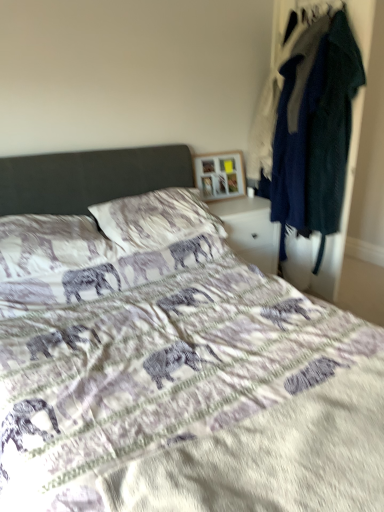
Question: Which direction should I rotate to look at textured white pillow at center, acting as the 1th pillow starting from the right?

Choices:
 (A) left
 (B) right

Answer: (A)

Question: Considering the relative sizes of white glossy nightstand at center and textured cotton pillow at center, acting as the first pillow starting from the left, in the image provided, is white glossy nightstand at center taller than textured cotton pillow at center, acting as the first pillow starting from the left,?

Choices:
 (A) yes
 (B) no

Answer: (A)

Question: Is white glossy nightstand at center closer to camera compared to textured cotton pillow at center, arranged as the 2th pillow when viewed from the right?

Choices:
 (A) no
 (B) yes

Answer: (A)

Question: Is white glossy nightstand at center outside textured cotton pillow at center, acting as the first pillow starting from the left?

Choices:
 (A) yes
 (B) no

Answer: (A)

Question: Is white glossy nightstand at center shorter than textured cotton pillow at center, arranged as the 2th pillow when viewed from the right?

Choices:
 (A) no
 (B) yes

Answer: (A)

Question: Can you confirm if white glossy nightstand at center is positioned to the left of textured cotton pillow at center, arranged as the 2th pillow when viewed from the right?

Choices:
 (A) no
 (B) yes

Answer: (A)

Question: Is white glossy nightstand at center oriented towards textured cotton pillow at center, arranged as the 2th pillow when viewed from the right?

Choices:
 (A) no
 (B) yes

Answer: (A)

Question: Is textured cotton pillow at center, arranged as the 2th pillow when viewed from the right, positioned before printed fabric bed at center?

Choices:
 (A) yes
 (B) no

Answer: (B)

Question: Can you confirm if textured cotton pillow at center, acting as the first pillow starting from the left, is taller than printed fabric bed at center?

Choices:
 (A) yes
 (B) no

Answer: (B)

Question: From the image's perspective, would you say textured cotton pillow at center, acting as the first pillow starting from the left, is positioned over printed fabric bed at center?

Choices:
 (A) no
 (B) yes

Answer: (B)

Question: Does textured cotton pillow at center, acting as the first pillow starting from the left, have a larger size compared to printed fabric bed at center?

Choices:
 (A) no
 (B) yes

Answer: (A)

Question: From the image's perspective, would you say textured cotton pillow at center, acting as the first pillow starting from the left, is shown under printed fabric bed at center?

Choices:
 (A) yes
 (B) no

Answer: (B)

Question: Is printed fabric bed at center a part of textured cotton pillow at center, arranged as the 2th pillow when viewed from the right?

Choices:
 (A) no
 (B) yes

Answer: (A)

Question: From a real-world perspective, does textured cotton pillow at center, acting as the first pillow starting from the left, stand above wooden picture frame at upper center?

Choices:
 (A) yes
 (B) no

Answer: (B)